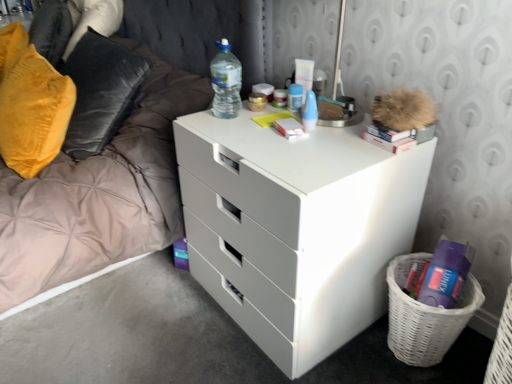
Question: Is white matte book at center, which ranks as the second book in right-to-left order, shorter than velvet yellow pillow at left?

Choices:
 (A) no
 (B) yes

Answer: (B)

Question: Considering the relative positions of white matte book at center, which ranks as the second book in right-to-left order, and velvet yellow pillow at left in the image provided, is white matte book at center, which ranks as the second book in right-to-left order, in front of velvet yellow pillow at left?

Choices:
 (A) yes
 (B) no

Answer: (A)

Question: Could you tell me if white matte book at center, which ranks as the second book in right-to-left order, is turned towards velvet yellow pillow at left?

Choices:
 (A) yes
 (B) no

Answer: (B)

Question: Is white matte book at center, which ranks as the second book in right-to-left order, in contact with velvet yellow pillow at left?

Choices:
 (A) yes
 (B) no

Answer: (B)

Question: Is white matte book at center, which ranks as the second book in right-to-left order, smaller than velvet yellow pillow at left?

Choices:
 (A) no
 (B) yes

Answer: (B)

Question: In terms of size, does blue plastic spray can at upper center, the first toiletry from the front, appear bigger or smaller than white plastic tube at upper center, positioned as the 1th toiletry in back-to-front order?

Choices:
 (A) big
 (B) small

Answer: (A)

Question: From a real-world perspective, relative to white plastic tube at upper center, positioned as the 1th toiletry in back-to-front order, is blue plastic spray can at upper center, the first toiletry from the front, vertically above or below?

Choices:
 (A) below
 (B) above

Answer: (B)

Question: In the image, is blue plastic spray can at upper center, the first toiletry from the front, positioned in front of or behind white plastic tube at upper center, which is the 2th toiletry from front to back?

Choices:
 (A) behind
 (B) front

Answer: (B)

Question: In terms of width, does blue plastic spray can at upper center, the first toiletry from the front, look wider or thinner when compared to white plastic tube at upper center, which is the 2th toiletry from front to back?

Choices:
 (A) wide
 (B) thin

Answer: (B)

Question: Is white matte chest of drawers at center wider or thinner than white plastic tube at upper center, which is the 2th toiletry from front to back?

Choices:
 (A) thin
 (B) wide

Answer: (B)

Question: Is white matte chest of drawers at center in front of or behind white plastic tube at upper center, positioned as the 1th toiletry in back-to-front order, in the image?

Choices:
 (A) front
 (B) behind

Answer: (A)

Question: In terms of height, does white matte chest of drawers at center look taller or shorter compared to white plastic tube at upper center, which is the 2th toiletry from front to back?

Choices:
 (A) short
 (B) tall

Answer: (B)

Question: In the image, is white matte chest of drawers at center on the left side or the right side of white plastic tube at upper center, positioned as the 1th toiletry in back-to-front order?

Choices:
 (A) right
 (B) left

Answer: (A)

Question: Would you say velvet yellow pillow at left is to the left or to the right of white wicker basket at lower right in the picture?

Choices:
 (A) right
 (B) left

Answer: (B)

Question: In terms of height, does velvet yellow pillow at left look taller or shorter compared to white wicker basket at lower right?

Choices:
 (A) short
 (B) tall

Answer: (B)